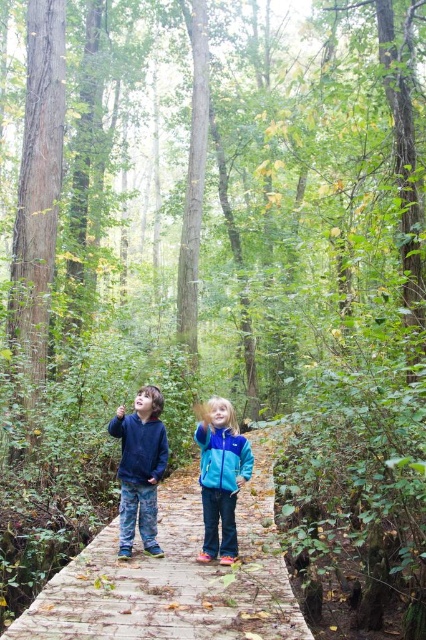
Question: Which point appears farthest from the camera in this image?

Choices:
 (A) (112, 540)
 (B) (229, 432)

Answer: (A)

Question: Which point is farther to the camera?

Choices:
 (A) denim pants at center
 (B) blue fleece jacket at center
 (C) teal fleece jacket at center

Answer: (C)

Question: Which object is the farthest from the denim pants at center?

Choices:
 (A) matte blue jacket at center
 (B) wooden bridge at center
 (C) teal fleece jacket at center
 (D) blue fleece jacket at center

Answer: (B)

Question: Considering the relative positions of wooden bridge at center and denim pants at center in the image provided, where is wooden bridge at center located with respect to denim pants at center?

Choices:
 (A) above
 (B) below

Answer: (B)

Question: Does wooden bridge at center appear under teal fleece jacket at center?

Choices:
 (A) yes
 (B) no

Answer: (A)

Question: Considering the relative positions of teal fleece jacket at center and matte blue jacket at center in the image provided, where is teal fleece jacket at center located with respect to matte blue jacket at center?

Choices:
 (A) below
 (B) above

Answer: (A)